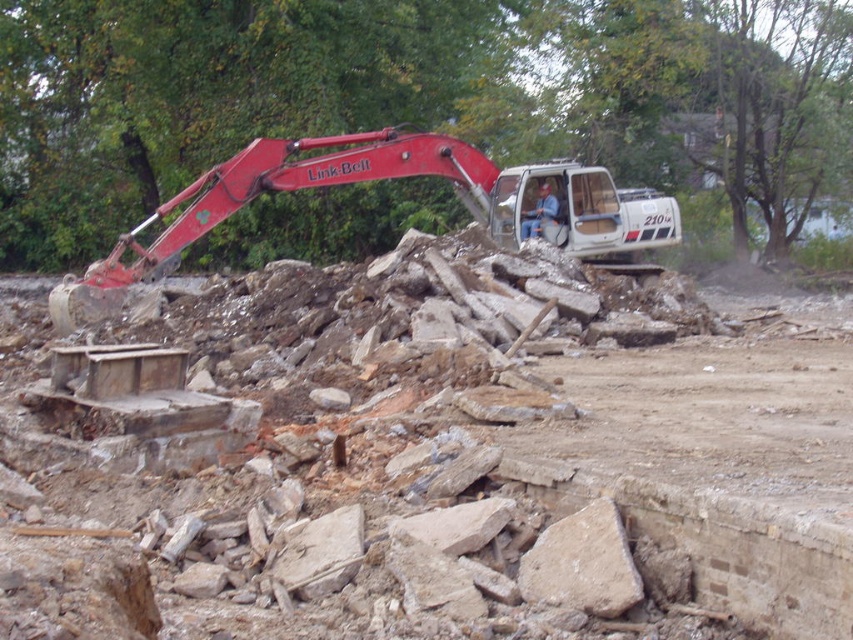
Question: Which of the following is the farthest from the observer?

Choices:
 (A) (538, 221)
 (B) (300, 138)
 (C) (24, 449)

Answer: (B)

Question: Which of the following is the closest to the observer?

Choices:
 (A) rusty metal debris at center
 (B) blue denim shirt at center
 (C) matte red excavator at upper left

Answer: (A)

Question: Is rusty metal debris at center to the right of blue denim shirt at center from the viewer's perspective?

Choices:
 (A) no
 (B) yes

Answer: (A)

Question: Is rusty metal debris at center smaller than matte red excavator at upper left?

Choices:
 (A) no
 (B) yes

Answer: (B)

Question: Which point is closer to the camera?

Choices:
 (A) tap(537, 225)
 (B) tap(113, 310)

Answer: (B)

Question: Is rusty metal debris at center above blue denim shirt at center?

Choices:
 (A) no
 (B) yes

Answer: (A)